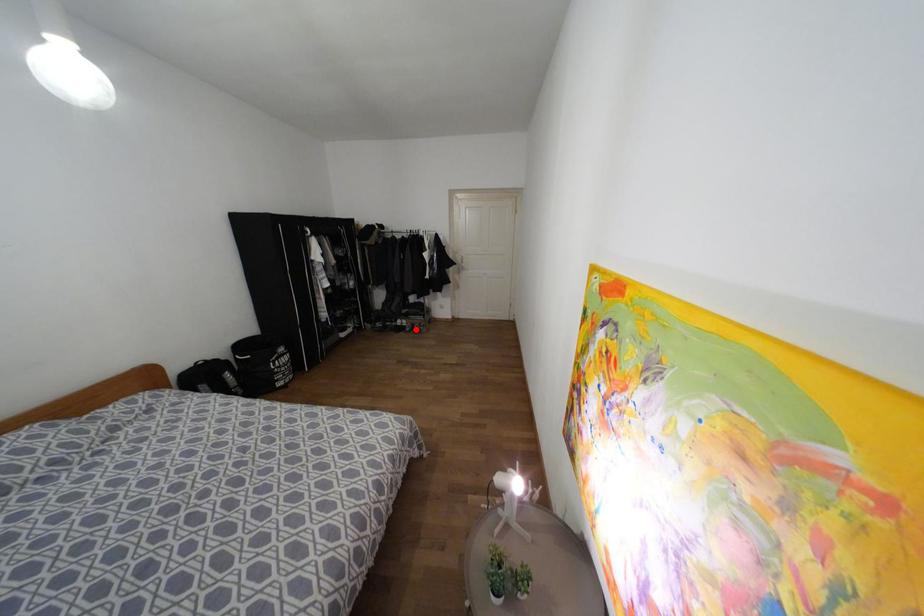
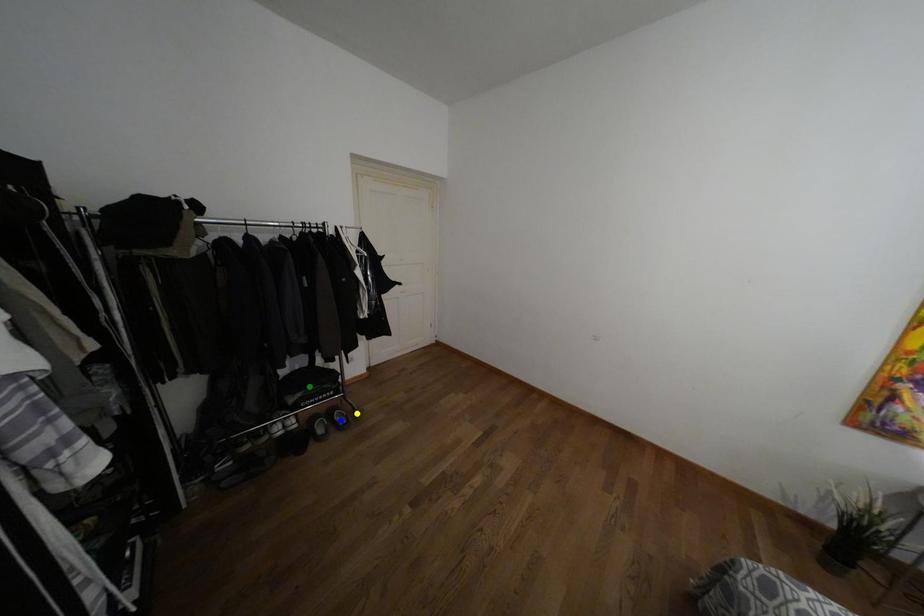
Question: I am providing you with two images of the same scene from different viewpoints. A red point is marked on the first image. You are given multiple points on the second image. Which spot in image 2 lines up with the point in image 1?

Choices:
 (A) blue point
 (B) green point
 (C) yellow point

Answer: (A)